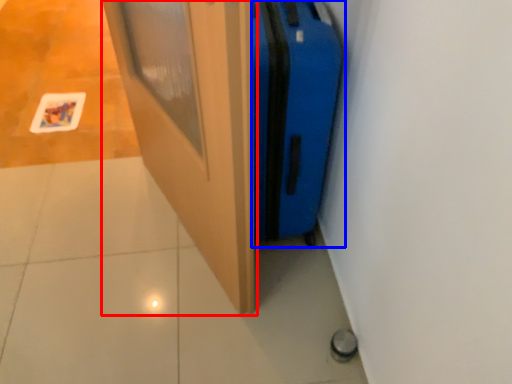
Question: Which of the following is the farthest to the observer, door (highlighted by a red box) or luggage (highlighted by a blue box)?

Choices:
 (A) door
 (B) luggage

Answer: (B)